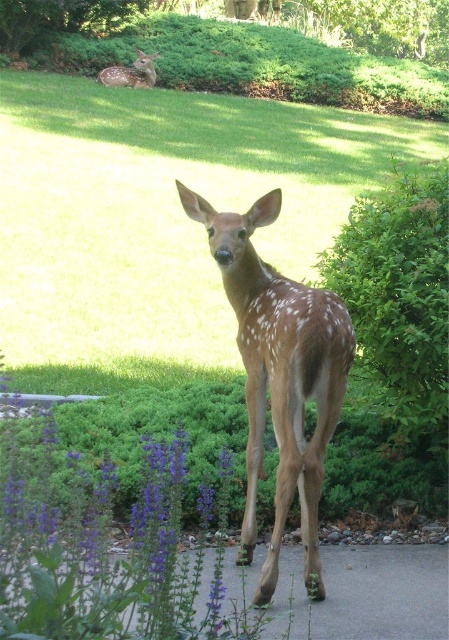
You are a photographer trying to capture a clear shot of the brown speckled fur at center and the gray asphalt pavement at lower center. Which object is closer to the camera?

The brown speckled fur at center is closer to the camera since it is further to the viewer than the gray asphalt pavement at lower center.